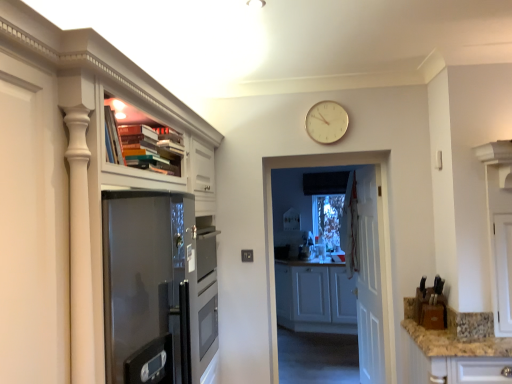
What do you see at coordinates (474, 325) in the screenshot? I see `granite countertop at lower right` at bounding box center [474, 325].

How much space does matte white cabinet at upper left, marked as the 2th cabinetry in a back-to-front arrangement, occupy horizontally?

matte white cabinet at upper left, marked as the 2th cabinetry in a back-to-front arrangement, is 15.97 inches wide.

What is the approximate width of white matte cabinet at center, the first cabinetry positioned from the back?

white matte cabinet at center, the first cabinetry positioned from the back, is 25.70 inches in width.

Find the location of a particular element. white glossy door at center is located at coordinates (379, 242).

In order to face white wooden door at center, should I rotate leftwards or rightwards?

You should look right and rotate roughly 14.592 degrees.

From the picture: What is the approximate width of gold metallic clock at upper center?

The width of gold metallic clock at upper center is 1.68 inches.

At what (x,y) coordinates should I click in order to perform the action: click on granite countertop at lower right. Please return your answer as a coordinate pair (x, y). Looking at the image, I should click on (455, 357).

Locate an element on the screen. The height and width of the screenshot is (384, 512). granite countertop at lower right is located at coordinates (474, 325).

Is gold metallic clock at upper center shorter than granite countertop at lower right?

No.

Which is more to the left, gold metallic clock at upper center or granite countertop at lower right?

gold metallic clock at upper center.

From a real-world perspective, relative to granite countertop at lower right, is gold metallic clock at upper center vertically above or below?

gold metallic clock at upper center is situated higher than granite countertop at lower right in the real world.

Is granite countertop at lower right inside gold metallic clock at upper center?

No, gold metallic clock at upper center does not contain granite countertop at lower right.

Based on the photo, which of these two, white glossy door at center or matte white cabinet at upper left, acting as the 1th cabinetry starting from the front, stands taller?

Standing taller between the two is matte white cabinet at upper left, acting as the 1th cabinetry starting from the front.

Is white glossy door at center to the right of matte white cabinet at upper left, the 1th cabinetry from the left, from the viewer's perspective?

Yes.

Consider the image. Can you confirm if white glossy door at center is wider than matte white cabinet at upper left, acting as the 2th cabinetry starting from the right?

No.

Which point is more distant from viewer, (296, 157) or (12, 206)?

Point (296, 157)

Does white wooden door at center have a lesser height compared to matte white cabinet at upper left, acting as the 1th cabinetry starting from the front?

No.

From the image's perspective, which is below, white wooden door at center or matte white cabinet at upper left, acting as the 2th cabinetry starting from the right?

white wooden door at center, from the image's perspective.

In terms of size, does white wooden door at center appear bigger or smaller than matte white cabinet at upper left, acting as the 2th cabinetry starting from the right?

In the image, white wooden door at center appears to be smaller than matte white cabinet at upper left, acting as the 2th cabinetry starting from the right.

What's the angular difference between white wooden door at center and matte white cabinet at upper left, acting as the 1th cabinetry starting from the front,'s facing directions?

The angle between the facing direction of white wooden door at center and the facing direction of matte white cabinet at upper left, acting as the 1th cabinetry starting from the front, is 173 degrees.

Is granite countertop at lower right shorter than white glossy door at center?

Yes.

Are granite countertop at lower right and white glossy door at center located far from each other?

No, granite countertop at lower right is not far from white glossy door at center.

Considering the positions of points (481, 375) and (274, 368), is point (481, 375) closer to camera compared to point (274, 368)?

Yes, it is in front of point (274, 368).

Based on their sizes in the image, would you say granite countertop at lower right is bigger or smaller than white glossy door at center?

Clearly, granite countertop at lower right is larger in size than white glossy door at center.

Considering the relative positions of white matte cabinet at center, the first cabinetry viewed from the right, and granite countertop at lower right in the image provided, is white matte cabinet at center, the first cabinetry viewed from the right, to the left of granite countertop at lower right from the viewer's perspective?

Yes, white matte cabinet at center, the first cabinetry viewed from the right, is to the left of granite countertop at lower right.

Does point (321, 300) lie behind point (477, 366)?

Yes, point (321, 300) is farther from viewer.

Is the surface of white matte cabinet at center, which is the second cabinetry from front to back, in direct contact with granite countertop at lower right?

No, white matte cabinet at center, which is the second cabinetry from front to back, is not beside granite countertop at lower right.

Is white matte cabinet at center, the 2th cabinetry from the left, wider than granite countertop at lower right?

No.

Identify the location of cabinetry that is the 2nd object located below the gold metallic clock at upper center (from the image's perspective). (315, 298).

Considering the positions of points (312, 106) and (341, 331), is point (312, 106) farther from camera compared to point (341, 331)?

No, it is in front of (341, 331).

Consider the image. Could you tell me if gold metallic clock at upper center is facing white matte cabinet at center, the 2th cabinetry from the left?

No, gold metallic clock at upper center is not aimed at white matte cabinet at center, the 2th cabinetry from the left.

Is white glossy door at center directly adjacent to granite countertop at lower right?

white glossy door at center and granite countertop at lower right are clearly separated.

How different are the orientations of white glossy door at center and granite countertop at lower right in degrees?

white glossy door at center and granite countertop at lower right are facing 180 degrees away from each other.

Which is behind, point (271, 164) or point (479, 315)?

The point (271, 164) is farther.

Is white glossy door at center turned away from granite countertop at lower right?

No, white glossy door at center is not facing the opposite direction of granite countertop at lower right.

At what (x,y) coordinates should I click in order to perform the action: click on gray that appears on the right of gold metallic clock at upper center. Please return your answer as a coordinate pair (x, y). This screenshot has height=384, width=512. Looking at the image, I should click on (474, 325).

Locate an element on the screen. This screenshot has height=384, width=512. cabinetry located above the white glossy door at center (from a real-world perspective) is located at coordinates (70, 188).

Estimate the real-world distances between objects in this image. Which object is closer to white matte cabinet at center, the first cabinetry positioned from the back, matte white cabinet at upper left, marked as the 2th cabinetry in a back-to-front arrangement, or white wooden door at center?

The object closer to white matte cabinet at center, the first cabinetry positioned from the back, is white wooden door at center.

Considering their positions, is granite countertop at lower right positioned further to matte white cabinet at upper left, acting as the 2th cabinetry starting from the right, than granite countertop at lower right?

The object further to matte white cabinet at upper left, acting as the 2th cabinetry starting from the right, is granite countertop at lower right.

Considering their positions, is gold metallic clock at upper center positioned further to matte white cabinet at upper left, acting as the 1th cabinetry starting from the front, than granite countertop at lower right?

Among the two, granite countertop at lower right is located further to matte white cabinet at upper left, acting as the 1th cabinetry starting from the front.

Estimate the real-world distances between objects in this image. Which object is further from granite countertop at lower right, white wooden door at center or matte white cabinet at upper left, marked as the 2th cabinetry in a back-to-front arrangement?

matte white cabinet at upper left, marked as the 2th cabinetry in a back-to-front arrangement, is positioned further to the anchor granite countertop at lower right.

Based on their spatial positions, is gold metallic clock at upper center or white wooden door at center closer to granite countertop at lower right?

The object closer to granite countertop at lower right is white wooden door at center.

Looking at the image, which one is located further to granite countertop at lower right, granite countertop at lower right or white wooden door at center?

white wooden door at center lies further to granite countertop at lower right than the other object.

Based on their spatial positions, is white matte cabinet at center, the first cabinetry positioned from the back, or white wooden door at center closer to granite countertop at lower right?

white wooden door at center lies closer to granite countertop at lower right than the other object.

Considering their positions, is matte white cabinet at upper left, the 1th cabinetry from the left, positioned further to gold metallic clock at upper center than white matte cabinet at center, the first cabinetry positioned from the back?

Based on the image, white matte cabinet at center, the first cabinetry positioned from the back, appears to be further to gold metallic clock at upper center.

Locate an element on the screen. This screenshot has height=384, width=512. gray between matte white cabinet at upper left, the 1th cabinetry from the left, and white wooden door at center, along the z-axis is located at coordinates (474, 325).

Where is `gray between gold metallic clock at upper center and white wooden door at center vertically`? This screenshot has height=384, width=512. gray between gold metallic clock at upper center and white wooden door at center vertically is located at coordinates 474,325.

The image size is (512, 384). In order to click on screen door between matte white cabinet at upper left, the 1th cabinetry from the left, and white matte cabinet at center, the 2th cabinetry from the left, in the front-back direction in this screenshot , I will do `click(379, 242)`.

Locate an element on the screen. The width and height of the screenshot is (512, 384). gray positioned between granite countertop at lower right and white matte cabinet at center, which is the second cabinetry from front to back, from near to far is located at coordinates (474, 325).